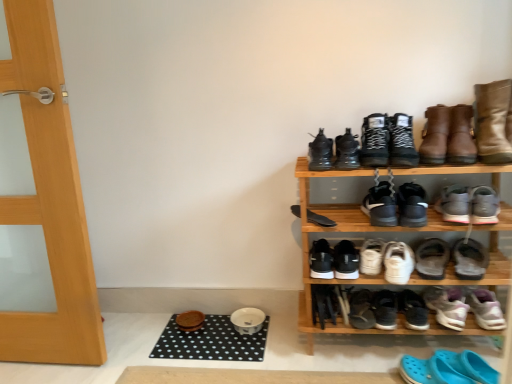
Question: Is black leather sneakers at upper center, which ranks as the second footwear in top-to-bottom order, beside black matte sneakers at center, which appears as the 6th footwear when viewed from the top?

Choices:
 (A) no
 (B) yes

Answer: (A)

Question: From the image's perspective, does black leather sneakers at upper center, which ranks as the second footwear in top-to-bottom order, appear higher than black matte sneakers at center, arranged as the 15th footwear when ordered from the bottom?

Choices:
 (A) no
 (B) yes

Answer: (B)

Question: Could you tell me if black leather sneakers at upper center, the 19th footwear in the bottom-to-top sequence, is facing black matte sneakers at center, arranged as the 15th footwear when ordered from the bottom?

Choices:
 (A) yes
 (B) no

Answer: (B)

Question: Does black leather sneakers at upper center, the 19th footwear in the bottom-to-top sequence, have a lesser height compared to black matte sneakers at center, arranged as the 15th footwear when ordered from the bottom?

Choices:
 (A) no
 (B) yes

Answer: (A)

Question: Is black leather sneakers at upper center, which ranks as the second footwear in top-to-bottom order, bigger than black matte sneakers at center, which appears as the 6th footwear when viewed from the top?

Choices:
 (A) yes
 (B) no

Answer: (A)

Question: Looking at the image, does purple suede sneakers at lower right, acting as the 16th footwear starting from the top, seem bigger or smaller compared to brown leather boot at upper right?

Choices:
 (A) big
 (B) small

Answer: (B)

Question: From a real-world perspective, is purple suede sneakers at lower right, which appears as the 5th footwear when ordered from the bottom, above or below brown leather boot at upper right?

Choices:
 (A) below
 (B) above

Answer: (A)

Question: In terms of width, does purple suede sneakers at lower right, acting as the 16th footwear starting from the top, look wider or thinner when compared to brown leather boot at upper right?

Choices:
 (A) wide
 (B) thin

Answer: (B)

Question: Is point (445, 327) positioned closer to the camera than point (461, 117)?

Choices:
 (A) farther
 (B) closer

Answer: (A)

Question: Is black matte sneakers at center, arranged as the 15th footwear when ordered from the bottom, inside or outside of black matte sneakers at lower center, marked as the 3th footwear in a bottom-to-top arrangement?

Choices:
 (A) inside
 (B) outside

Answer: (B)

Question: Looking at the image, does black matte sneakers at center, arranged as the 15th footwear when ordered from the bottom, seem bigger or smaller compared to black matte sneakers at lower center, which is counted as the 18th footwear, starting from the top?

Choices:
 (A) big
 (B) small

Answer: (A)

Question: Would you say black matte sneakers at center, arranged as the 15th footwear when ordered from the bottom, is to the left or to the right of black matte sneakers at lower center, which is counted as the 18th footwear, starting from the top, in the picture?

Choices:
 (A) left
 (B) right

Answer: (B)

Question: Looking at their shapes, would you say black matte sneakers at center, arranged as the 15th footwear when ordered from the bottom, is wider or thinner than black matte sneakers at lower center, which is counted as the 18th footwear, starting from the top?

Choices:
 (A) thin
 (B) wide

Answer: (A)

Question: Does point (399, 302) appear closer or farther from the camera than point (464, 311)?

Choices:
 (A) closer
 (B) farther

Answer: (B)

Question: Would you say black matte sneakers at lower center, which is counted as the 4th footwear, starting from the bottom, is to the left or to the right of purple suede sneakers at lower right, acting as the 16th footwear starting from the top, in the picture?

Choices:
 (A) left
 (B) right

Answer: (A)